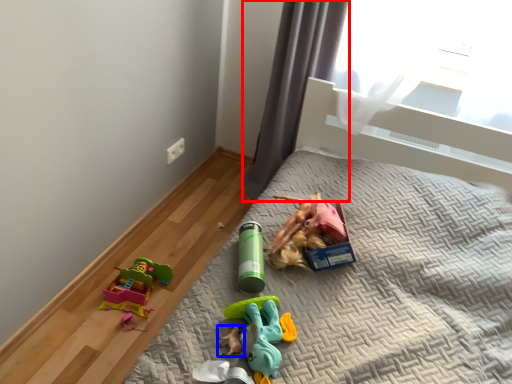
Question: Which point is further to the camera, curtain (highlighted by a red box) or toy (highlighted by a blue box)?

Choices:
 (A) curtain
 (B) toy

Answer: (A)